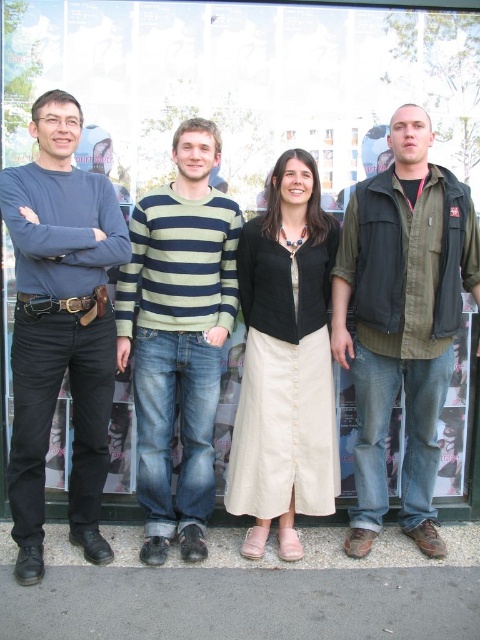
Who is shorter, green cotton shirt at center or beige cotton skirt at center?

Standing shorter between the two is beige cotton skirt at center.

Does green cotton shirt at center have a greater height compared to beige cotton skirt at center?

Correct, green cotton shirt at center is much taller as beige cotton skirt at center.

Locate an element on the screen. green cotton shirt at center is located at coordinates (402, 321).

I want to click on green cotton shirt at center, so click(402, 321).

Is striped knit sweater at center shorter than beige cotton skirt at center?

No, striped knit sweater at center is not shorter than beige cotton skirt at center.

Which is above, striped knit sweater at center or beige cotton skirt at center?

Positioned higher is striped knit sweater at center.

Does point (177, 221) lie in front of point (256, 369)?

Yes, it is.

Locate an element on the screen. The height and width of the screenshot is (640, 480). striped knit sweater at center is located at coordinates (179, 337).

Is green cotton shirt at center positioned at the back of striped knit sweater at center?

No, green cotton shirt at center is closer to the viewer.

Who is positioned more to the left, green cotton shirt at center or striped knit sweater at center?

striped knit sweater at center

Who is more forward, (x=384, y=342) or (x=192, y=198)?

Positioned in front is point (x=384, y=342).

What are the coordinates of `green cotton shirt at center` in the screenshot? It's located at (402, 321).